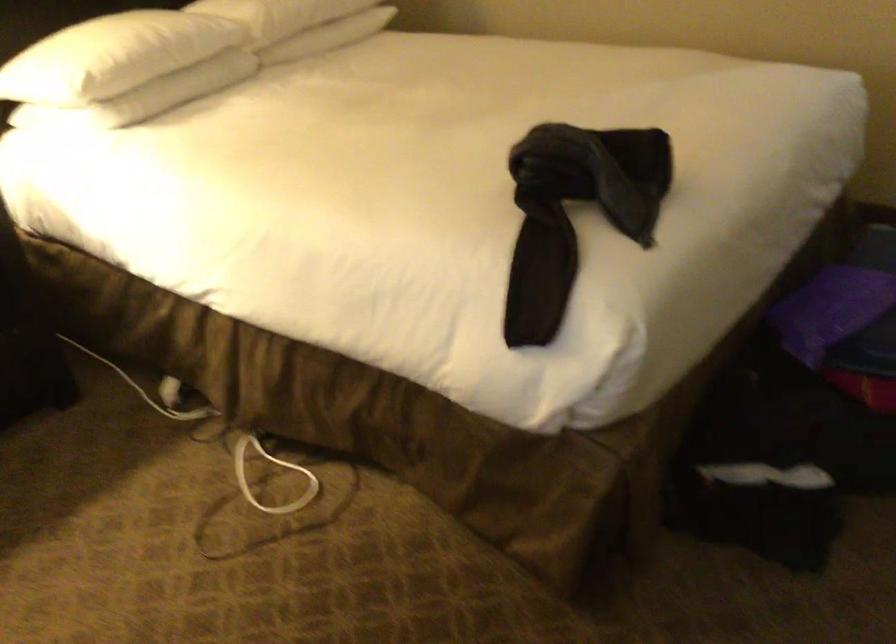
The location [831,310] corresponds to which object?

It refers to a purple package.